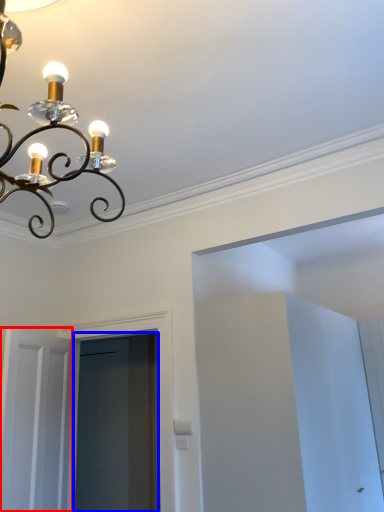
Question: Which object appears closest to the camera in this image, door (highlighted by a red box) or screen door (highlighted by a blue box)?

Choices:
 (A) door
 (B) screen door

Answer: (A)